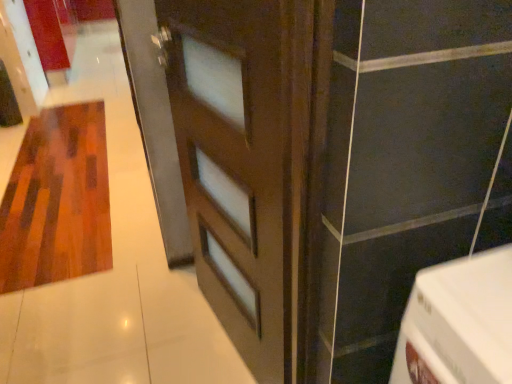
What do you see at coordinates (246, 165) in the screenshot? I see `brown matte door at center` at bounding box center [246, 165].

Find the location of a particular element. brown matte door at center is located at coordinates click(246, 165).

Where is `wooden textured rug at left`? This screenshot has width=512, height=384. wooden textured rug at left is located at coordinates (57, 200).

Describe the element at coordinates (57, 200) in the screenshot. The image size is (512, 384). I see `wooden textured rug at left` at that location.

Locate an element on the screen. brown matte door at center is located at coordinates (246, 165).

Based on their positions, is brown matte door at center located to the left or right of wooden textured rug at left?

brown matte door at center is to the right of wooden textured rug at left.

Does brown matte door at center lie in front of wooden textured rug at left?

Yes, it is in front of wooden textured rug at left.

Considering the positions of point (249, 10) and point (91, 106), is point (249, 10) closer or farther from the camera than point (91, 106)?

Point (249, 10) is closer to the camera than point (91, 106).

Looking at this image, from the image's perspective, between brown matte door at center and wooden textured rug at left, which one is located above?

wooden textured rug at left is shown above in the image.

From a real-world perspective, is brown matte door at center positioned over wooden textured rug at left based on gravity?

Yes, from a real-world perspective, brown matte door at center is above wooden textured rug at left.

Does brown matte door at center have a lesser width compared to wooden textured rug at left?

Yes.

Is brown matte door at center taller than wooden textured rug at left?

Yes, brown matte door at center is taller than wooden textured rug at left.

Is brown matte door at center bigger or smaller than wooden textured rug at left?

Considering their sizes, brown matte door at center takes up less space than wooden textured rug at left.

Would you say brown matte door at center is outside wooden textured rug at left?

brown matte door at center lies outside wooden textured rug at left's area.

Is there a large distance between brown matte door at center and wooden textured rug at left?

brown matte door at center is positioned a significant distance from wooden textured rug at left.

Is brown matte door at center facing away from wooden textured rug at left?

That's not correct — brown matte door at center is not looking away from wooden textured rug at left.

How far apart are brown matte door at center and wooden textured rug at left?

brown matte door at center is 4.38 feet from wooden textured rug at left.

In order to click on door to the right of wooden textured rug at left in this screenshot , I will do `click(246, 165)`.

Which is more to the left, wooden textured rug at left or brown matte door at center?

wooden textured rug at left is more to the left.

Considering the positions of objects wooden textured rug at left and brown matte door at center in the image provided, who is behind, wooden textured rug at left or brown matte door at center?

wooden textured rug at left is more distant.

Which is nearer, (17, 240) or (224, 304)?

The point (224, 304) is in front.

From the image's perspective, which is above, wooden textured rug at left or brown matte door at center?

wooden textured rug at left appears higher in the image.

From a real-world perspective, between wooden textured rug at left and brown matte door at center, who is vertically lower?

wooden textured rug at left is physically lower.

Considering the sizes of objects wooden textured rug at left and brown matte door at center in the image provided, who is wider, wooden textured rug at left or brown matte door at center?

wooden textured rug at left.

Based on the photo, is wooden textured rug at left shorter than brown matte door at center?

Yes, wooden textured rug at left is shorter than brown matte door at center.

Considering the relative sizes of wooden textured rug at left and brown matte door at center in the image provided, is wooden textured rug at left bigger than brown matte door at center?

Indeed, wooden textured rug at left has a larger size compared to brown matte door at center.

Does wooden textured rug at left contain brown matte door at center?

Definitely not — brown matte door at center is not inside wooden textured rug at left.

Would you say wooden textured rug at left is a long distance from brown matte door at center?

That's right, there is a large distance between wooden textured rug at left and brown matte door at center.

Is brown matte door at center at the back of wooden textured rug at left?

No.

Looking at this image, how different are the orientations of wooden textured rug at left and brown matte door at center in degrees?

The angle between the facing direction of wooden textured rug at left and the facing direction of brown matte door at center is 101 degrees.

Measure the distance between wooden textured rug at left and brown matte door at center.

wooden textured rug at left is 1.34 meters from brown matte door at center.

You are a GUI agent. You are given a task and a screenshot of the screen. Output one action in this format:
    pyautogui.click(x=<x>, y=<y>)
    Task: Click on the hardwood above the brown matte door at center (from the image's perspective)
    
    Given the screenshot: What is the action you would take?
    pyautogui.click(x=57, y=200)

Identify the location of hardwood located on the left of brown matte door at center. pyautogui.click(x=57, y=200).

Locate an element on the screen. This screenshot has width=512, height=384. door in front of the wooden textured rug at left is located at coordinates (246, 165).